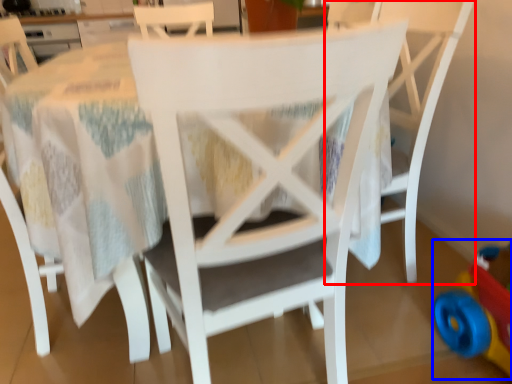
Question: Which object is further to the camera taking this photo, chair (highlighted by a red box) or toy (highlighted by a blue box)?

Choices:
 (A) chair
 (B) toy

Answer: (A)